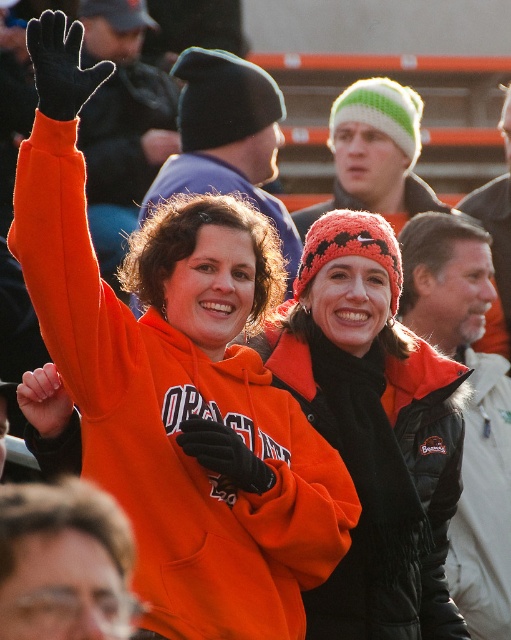
You are a photographer trying to capture the perfect shot of the orange fleece sweatshirt at upper left and the knitted wool beanie at center. Based on their positions, which object should you focus on first to ensure both are in frame?

The orange fleece sweatshirt at upper left is located above the knitted wool beanie at center, so you should focus on the orange fleece sweatshirt at upper left first to ensure both are in frame.

You are a photographer at the event and want to capture a photo that includes both the orange fleece sweatshirt at upper left and the knitted wool beanie at center. Based on their positions, which object should you focus on first to ensure both are in frame?

The orange fleece sweatshirt at upper left is positioned on the left side of the knitted wool beanie at center, so you should focus on the orange fleece sweatshirt at upper left first to ensure both are in frame.

You are a photographer standing at the edge of the field, and you want to take a photo that includes both the orange fleece sweatshirt at upper left and the knitted wool beanie at center. Given that your camera has a maximum focus range of 15 feet, will you be able to capture both subjects in focus?

The distance between the orange fleece sweatshirt at upper left and the knitted wool beanie at center is 14.78 feet, which is within the camera maximum focus range of 15 feet. Therefore, both subjects can be captured in focus.